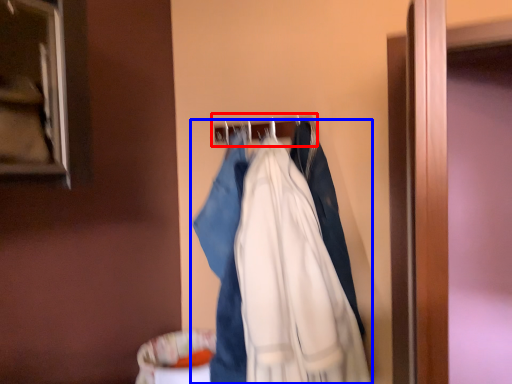
Question: Which of the following is the farthest to the observer, hanger (highlighted by a red box) or fancy dress (highlighted by a blue box)?

Choices:
 (A) hanger
 (B) fancy dress

Answer: (A)